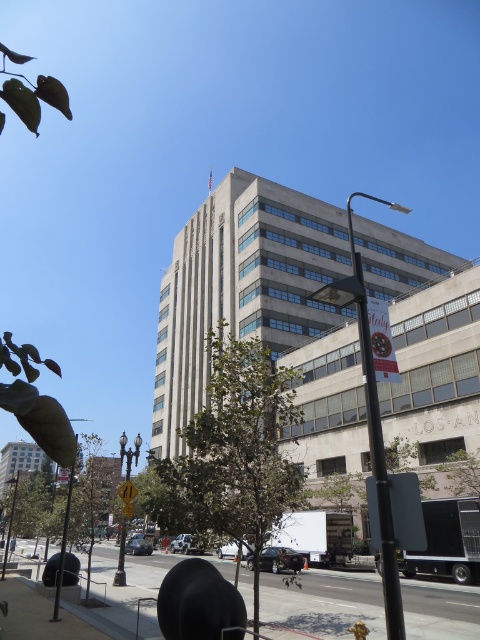
Between green leafy tree at lower left and yellow reflective street sign at center, which one appears on the right side from the viewer's perspective?

Positioned to the right is yellow reflective street sign at center.

Is green leafy tree at lower left to the left of yellow reflective street sign at center from the viewer's perspective?

Correct, you'll find green leafy tree at lower left to the left of yellow reflective street sign at center.

At what (x,y) coordinates should I click in order to perform the action: click on green leafy tree at lower left. Please return your answer as a coordinate pair (x, y). The height and width of the screenshot is (640, 480). Looking at the image, I should click on (96, 490).

At what (x,y) coordinates should I click in order to perform the action: click on green leafy tree at lower left. Please return your answer as a coordinate pair (x, y). Looking at the image, I should click on (96, 490).

Which of these two, green leafy tree at center or yellow reflective street sign at center, stands shorter?

Standing shorter between the two is green leafy tree at center.

Is green leafy tree at center further to camera compared to yellow reflective street sign at center?

No, green leafy tree at center is in front of yellow reflective street sign at center.

Who is more forward, (267, 472) or (119, 579)?

Point (267, 472)

You are a GUI agent. You are given a task and a screenshot of the screen. Output one action in this format:
    pyautogui.click(x=<x>, y=<y>)
    Task: Click on the green leafy tree at center
    The image size is (480, 640).
    Given the screenshot: What is the action you would take?
    pyautogui.click(x=232, y=452)

Is green leafy tree at center smaller than green leafy tree at lower left?

Yes.

Is green leafy tree at center shorter than green leafy tree at lower left?

Yes.

Where is `green leafy tree at center`? green leafy tree at center is located at coordinates tap(232, 452).